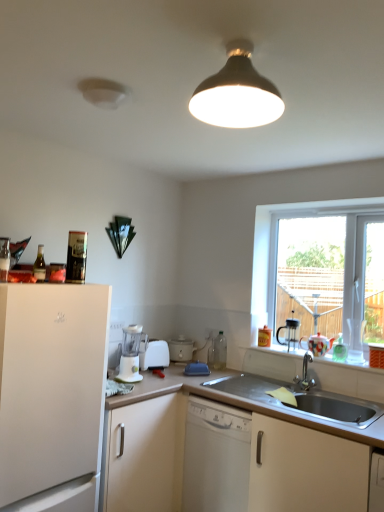
This screenshot has height=512, width=384. In order to click on vacant space situated above matte black lampshade at upper center (from a real-world perspective) in this screenshot , I will do `click(246, 37)`.